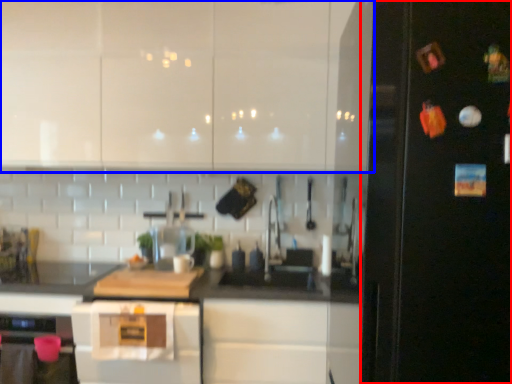
Question: Which object appears farthest to the camera in this image, fridge (highlighted by a red box) or cabinetry (highlighted by a blue box)?

Choices:
 (A) fridge
 (B) cabinetry

Answer: (B)